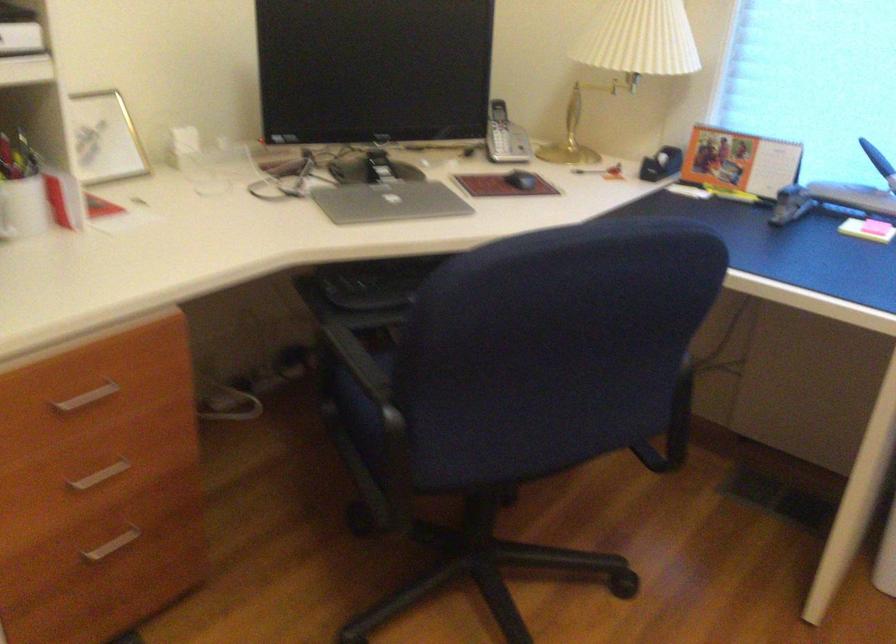
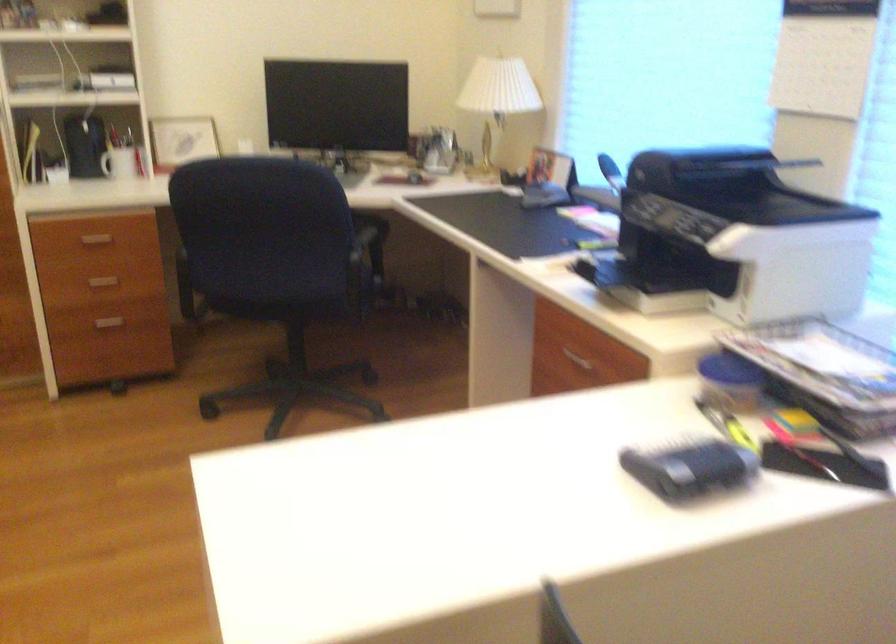
Looking at this image, the images are taken continuously from a first-person perspective. In which direction are you moving?

The movement direction of the cameraman is right, backward.